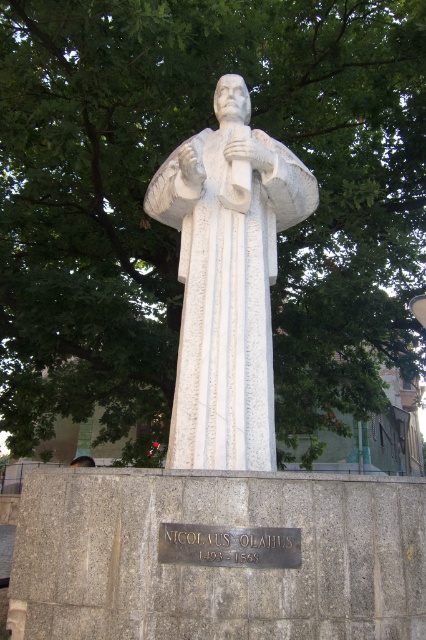
From the picture: You are a painter standing at the base of the statue and want to paint both the green leafy tree at upper center and the brown leather hat at lower left. Can you fit both subjects into your 1 meter wide canvas without moving your position?

The distance between the green leafy tree at upper center and the brown leather hat at lower left is 79.37 centimeters, which is less than the 1 meter width of your canvas. Therefore, you can fit both subjects into your canvas without moving.